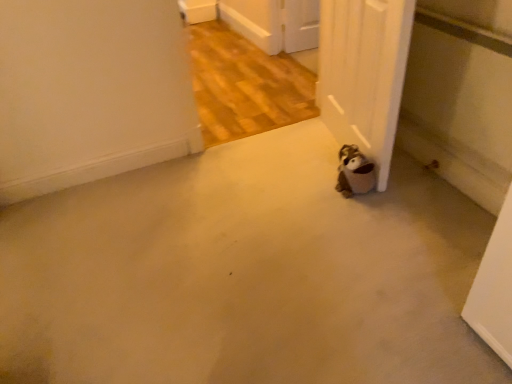
I want to click on free location to the left of brown plush toy at lower right, so click(313, 192).